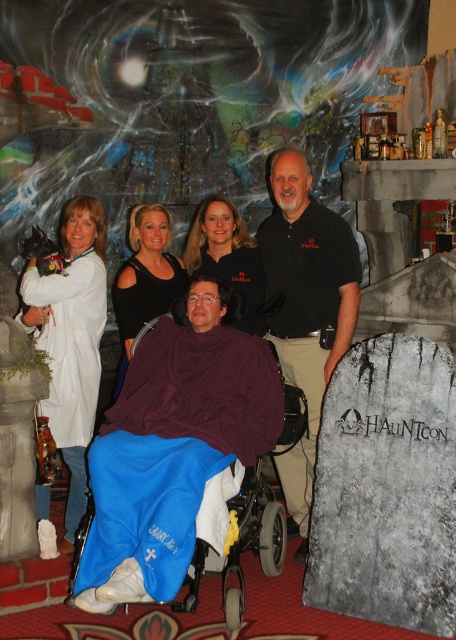
You are standing at the viewer position in the haunted house scene. There is a point marked at coordinates [275,156]. If you want to throw a small object to that point, will you need to aim higher or lower than your current line of sight?

The point at [275,156] is 15.58 feet away from the viewer. Since the distance is given but no vertical information is provided, we can assume the point is at eye level. Therefore, you should aim directly at the point without needing to adjust your aim higher or lower.

You are a photographer at HAUNTCON and need to position the maroon fleece wheelchair at center so that it is exactly 2 meters away from the tombstone. Given the current coordinates of the wheelchair at point 0.609, 0.443, can you determine if it is already positioned correctly?

The maroon fleece wheelchair at center is located at point (202, 388). Without knowing the tombstone coordinates, it is impossible to determine if the distance is exactly 2 meters. Please provide the tombstone coordinates for accurate calculation.

You are a photographer at HAUNTCON and need to capture a clear photo of the maroon fleece wheelchair at center and the black matte dress at center. Which object will appear larger in the photo?

The maroon fleece wheelchair at center will appear larger in the photo because it is closer to the viewer than the black matte dress at center.